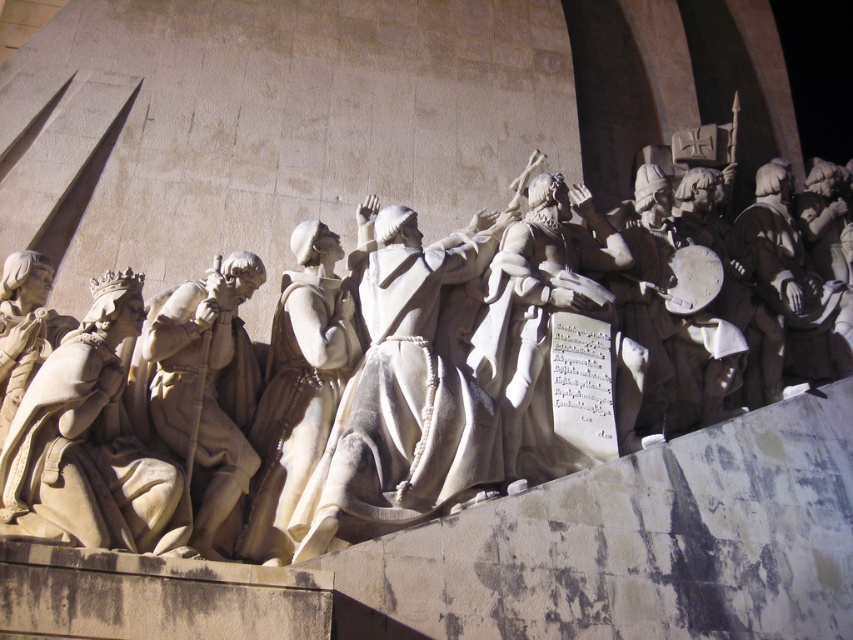
Can you confirm if white stone statue at center is positioned above white marble statue at left?

Correct, white stone statue at center is located above white marble statue at left.

Which is more to the left, white stone statue at center or white marble statue at left?

white marble statue at left

Which is behind, point (572, 452) or point (228, 312)?

The point (572, 452) is more distant.

Locate an element on the screen. This screenshot has height=640, width=853. white stone statue at center is located at coordinates (405, 378).

The image size is (853, 640). What do you see at coordinates (405, 378) in the screenshot?
I see `white stone statue at center` at bounding box center [405, 378].

Is point (816, 305) positioned in front of point (115, 486)?

No, (816, 305) is behind (115, 486).

The image size is (853, 640). What are the coordinates of `white stone statue at center` in the screenshot? It's located at (405, 378).

You are a GUI agent. You are given a task and a screenshot of the screen. Output one action in this format:
    pyautogui.click(x=<x>, y=<y>)
    Task: Click on the white stone statue at center
    The width and height of the screenshot is (853, 640).
    Given the screenshot: What is the action you would take?
    pyautogui.click(x=405, y=378)

Who is taller, beige stone statue at left or white marble statue at left?

Standing taller between the two is white marble statue at left.

Does point (30, 412) come in front of point (178, 314)?

Yes, it is.

Locate an element on the screen. The height and width of the screenshot is (640, 853). beige stone statue at left is located at coordinates (90, 444).